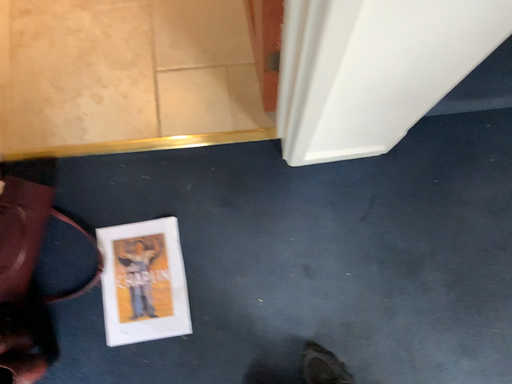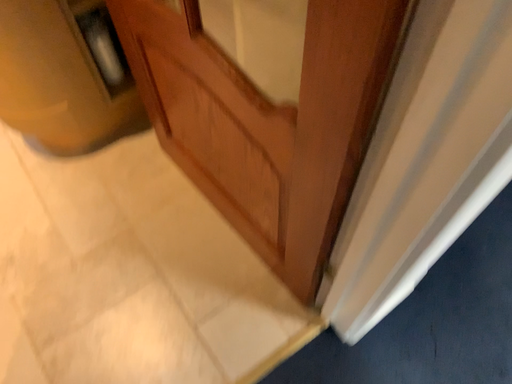
Question: Which way did the camera rotate in the video?

Choices:
 (A) rotated downward
 (B) rotated upward

Answer: (B)